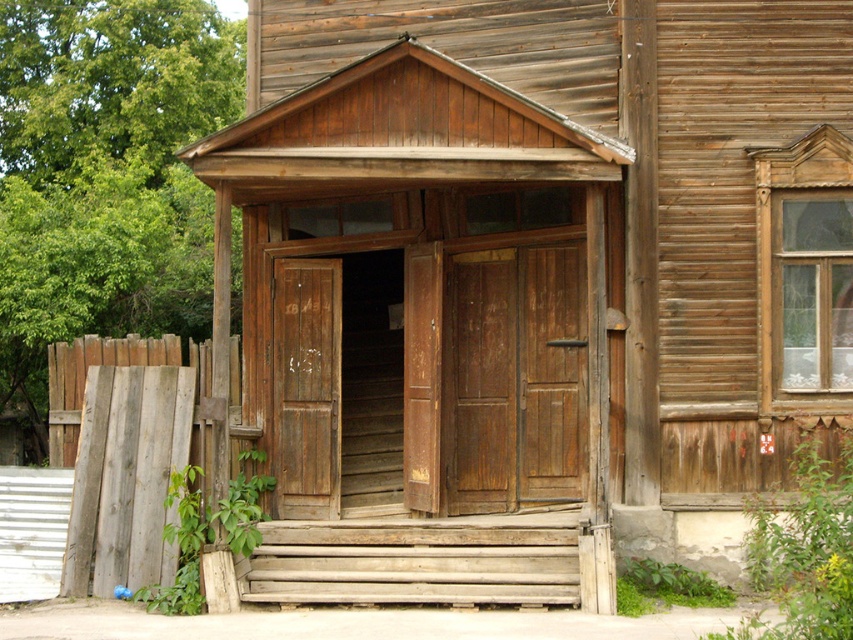
You are a painter who needs to decide which door to paint first. The dark brown wooden door at center and the weathered wood door at center are both at the entrance. Which door has a larger size and should be painted first?

The dark brown wooden door at center is bigger than the weathered wood door at center, so it should be painted first due to its larger size.

You are standing at the entrance of the wooden building and want to enter. The dark brown wooden door at center is your goal. Can you step onto the weathered wood stairs at center to reach the door?

The dark brown wooden door at center is located above the weathered wood stairs at center, so you can step onto the weathered wood stairs at center to reach the door.